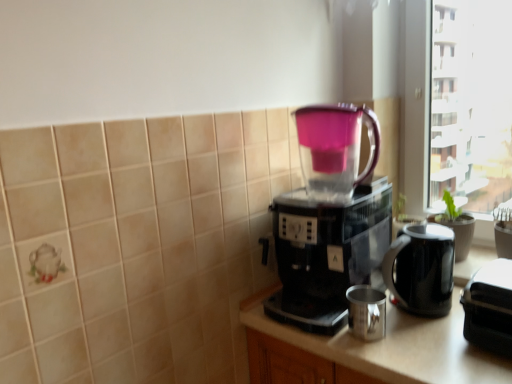
What do you see at coordinates (335, 148) in the screenshot? This screenshot has width=512, height=384. I see `transparent plastic pitcher at center` at bounding box center [335, 148].

The width and height of the screenshot is (512, 384). I want to click on black plastic coffee maker at center, so click(x=330, y=219).

Describe the element at coordinates (368, 351) in the screenshot. The width and height of the screenshot is (512, 384). I see `metallic silver cup at center` at that location.

Measure the distance between point (436, 307) and camera.

The distance of point (436, 307) from camera is 1.13 meters.

Where is `transparent plastic pitcher at center`? The image size is (512, 384). transparent plastic pitcher at center is located at coordinates (335, 148).

Does transparent plastic pitcher at center have a lesser width compared to black glossy electric kettle at right?

Correct, the width of transparent plastic pitcher at center is less than that of black glossy electric kettle at right.

Does transparent plastic pitcher at center lie behind black glossy electric kettle at right?

No, the depth of transparent plastic pitcher at center is less than that of black glossy electric kettle at right.

Which of these two, transparent plastic pitcher at center or black glossy electric kettle at right, is smaller?

black glossy electric kettle at right.

Looking at their sizes, would you say metallic silver mug at lower center is wider or thinner than black plastic coffee maker at center?

Considering their sizes, metallic silver mug at lower center looks slimmer than black plastic coffee maker at center.

Can you confirm if metallic silver mug at lower center is bigger than black plastic coffee maker at center?

Incorrect, metallic silver mug at lower center is not larger than black plastic coffee maker at center.

From the image's perspective, is metallic silver mug at lower center on black plastic coffee maker at center?

No, from the image's perspective, metallic silver mug at lower center is not over black plastic coffee maker at center.

How different are the orientations of metallic silver mug at lower center and black plastic coffee maker at center in degrees?

0.163 degrees.

Considering the sizes of objects metallic silver cup at center and transparent plastic pitcher at center in the image provided, who is taller, metallic silver cup at center or transparent plastic pitcher at center?

Standing taller between the two is metallic silver cup at center.

Can you confirm if metallic silver cup at center is bigger than transparent plastic pitcher at center?

Correct, metallic silver cup at center is larger in size than transparent plastic pitcher at center.

Is metallic silver cup at center positioned beyond the bounds of transparent plastic pitcher at center?

metallic silver cup at center is positioned outside transparent plastic pitcher at center.

Would you say metallic silver mug at lower center is a long distance from black glossy electric kettle at right?

They are positioned close to each other.

Is metallic silver mug at lower center shorter than black glossy electric kettle at right?

Yes, metallic silver mug at lower center is shorter than black glossy electric kettle at right.

From the image's perspective, who appears lower, metallic silver mug at lower center or black glossy electric kettle at right?

metallic silver mug at lower center, from the image's perspective.

Measure the distance from metallic silver mug at lower center to black glossy electric kettle at right.

metallic silver mug at lower center and black glossy electric kettle at right are 6.14 inches apart from each other.

Looking at this image, what's the angular difference between black glossy electric kettle at right and black plastic toaster at right's facing directions?

black glossy electric kettle at right and black plastic toaster at right are facing 5.46 degrees away from each other.

From their relative heights in the image, would you say black glossy electric kettle at right is taller or shorter than black plastic toaster at right?

Considering their sizes, black glossy electric kettle at right has more height than black plastic toaster at right.

Find the location of a particular element. The height and width of the screenshot is (384, 512). jug that is on the left side of black plastic toaster at right is located at coordinates (421, 269).

Based on the photo, from a real-world perspective, between black glossy electric kettle at right and black plastic toaster at right, who is vertically lower?

black plastic toaster at right is physically lower.

Which of these two, metallic silver cup at center or black plastic toaster at right, stands shorter?

With less height is black plastic toaster at right.

From the picture: Could you tell me if metallic silver cup at center is facing black plastic toaster at right?

No, metallic silver cup at center does not turn towards black plastic toaster at right.

Looking at this image, which object is more forward, metallic silver cup at center or black plastic toaster at right?

metallic silver cup at center is more forward.

From a real-world perspective, is metallic silver cup at center physically above black plastic toaster at right?

No.

In the scene shown: Is transparent plastic pitcher at center taller than metallic silver mug at lower center?

Yes.

From the image's perspective, is transparent plastic pitcher at center positioned above or below metallic silver mug at lower center?

From the image's perspective, transparent plastic pitcher at center appears above metallic silver mug at lower center.

Considering the sizes of transparent plastic pitcher at center and metallic silver mug at lower center in the image, is transparent plastic pitcher at center wider or thinner than metallic silver mug at lower center?

Clearly, transparent plastic pitcher at center has more width compared to metallic silver mug at lower center.

The image size is (512, 384). I want to click on coffeepot above the black glossy electric kettle at right (from a real-world perspective), so click(x=335, y=148).

Where is `mug that appears on the right of black plastic coffee maker at center`? mug that appears on the right of black plastic coffee maker at center is located at coordinates (366, 312).

Considering their positions, is metallic silver mug at lower center positioned further to black glossy electric kettle at right than black plastic coffee maker at center?

black plastic coffee maker at center.

Looking at the image, which one is located closer to metallic silver mug at lower center, black glossy electric kettle at right or black plastic coffee maker at center?

black glossy electric kettle at right is closer to metallic silver mug at lower center.

Looking at this image, when comparing their distances from metallic silver cup at center, does black plastic coffee maker at center or transparent plastic pitcher at center seem further?

transparent plastic pitcher at center is positioned further to the anchor metallic silver cup at center.

Looking at the image, which one is located further to transparent plastic pitcher at center, black plastic toaster at right or metallic silver cup at center?

black plastic toaster at right lies further to transparent plastic pitcher at center than the other object.

Considering their positions, is black plastic coffee maker at center positioned closer to transparent plastic pitcher at center than metallic silver mug at lower center?

Among the two, black plastic coffee maker at center is located nearer to transparent plastic pitcher at center.

Looking at the image, which one is located closer to metallic silver cup at center, black plastic coffee maker at center or metallic silver mug at lower center?

metallic silver mug at lower center lies closer to metallic silver cup at center than the other object.

Looking at the image, which one is located further to metallic silver mug at lower center, metallic silver cup at center or black glossy electric kettle at right?

black glossy electric kettle at right is positioned further to the anchor metallic silver mug at lower center.

When comparing their distances from transparent plastic pitcher at center, does black glossy electric kettle at right or metallic silver mug at lower center seem further?

Based on the image, metallic silver mug at lower center appears to be further to transparent plastic pitcher at center.

Image resolution: width=512 pixels, height=384 pixels. What are the coordinates of `appliance between black plastic coffee maker at center and metallic silver cup at center vertically` in the screenshot? It's located at (489, 307).

The height and width of the screenshot is (384, 512). Identify the location of jug located between metallic silver mug at lower center and black plastic toaster at right in the left-right direction. (421, 269).

Locate an element on the screen. coffee maker situated between transparent plastic pitcher at center and black plastic toaster at right from left to right is located at coordinates [330, 219].

Locate an element on the screen. The width and height of the screenshot is (512, 384). jug that lies between black plastic coffee maker at center and metallic silver cup at center from top to bottom is located at coordinates (421, 269).